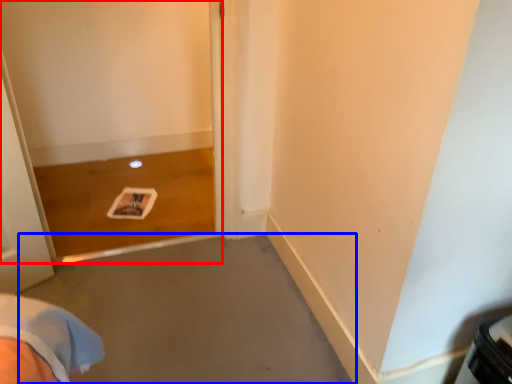
Question: Which object is closer to the camera taking this photo, screen door (highlighted by a red box) or concrete (highlighted by a blue box)?

Choices:
 (A) screen door
 (B) concrete

Answer: (B)